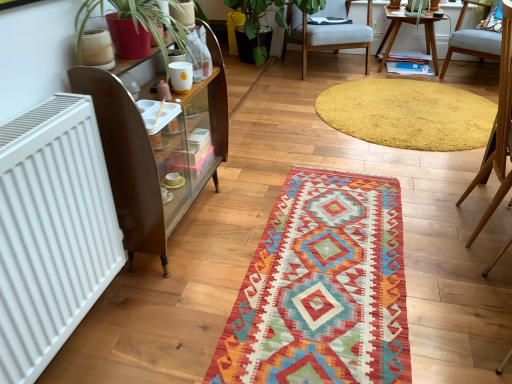
Question: Relative to brown wooden shelf at left, is wooden table at upper right in front or behind?

Choices:
 (A) front
 (B) behind

Answer: (B)

Question: Is wooden table at upper right inside or outside of brown wooden shelf at left?

Choices:
 (A) inside
 (B) outside

Answer: (B)

Question: Based on their relative distances, which object is farther from the yellow shaggy rug at upper center, the 1th mat viewed from the back?

Choices:
 (A) multicolored woven mat at center, which is the 2th mat in back-to-front order
 (B) brown wooden shelf at left
 (C) white matte radiator at left
 (D) light blue fabric chair at right, which is the 1th chair from front to back
 (E) wooden table at upper right

Answer: (C)

Question: Which of these objects is positioned farthest from the light blue fabric chair at right, which is the third chair from back to front?

Choices:
 (A) multicolored woven mat at center, which is the 2th mat in back-to-front order
 (B) white matte radiator at left
 (C) light gray fabric chair at upper right, arranged as the 2th chair when viewed from the front
 (D) wooden table at upper right
 (E) brown wooden shelf at left

Answer: (D)